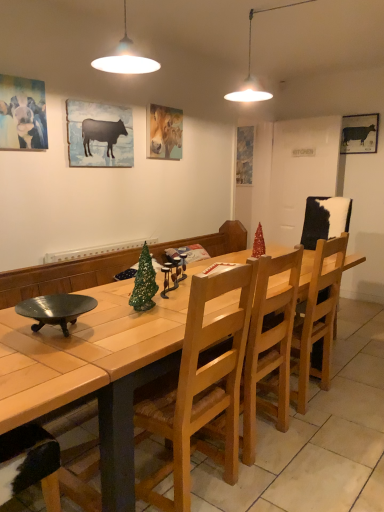
Where is `vacant space in front of shiny metallic bowl at lower left`? The image size is (384, 512). vacant space in front of shiny metallic bowl at lower left is located at coordinates (47, 358).